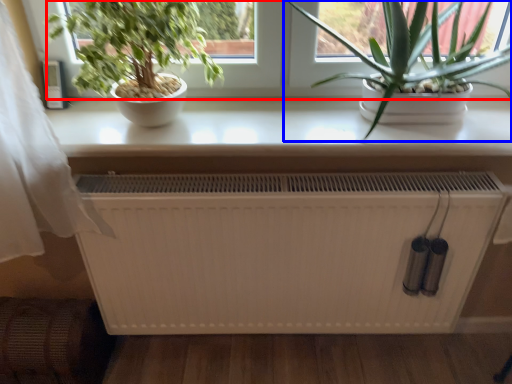
Question: Which object is further to the camera taking this photo, window screen (highlighted by a red box) or houseplant (highlighted by a blue box)?

Choices:
 (A) window screen
 (B) houseplant

Answer: (A)